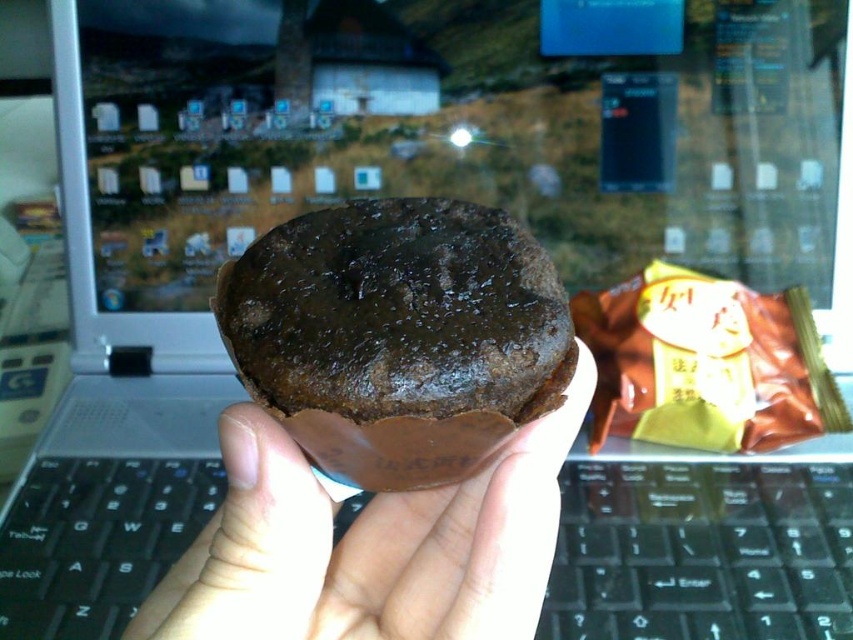
You are trying to determine the distance between two points in the image. The first point is located at coordinates point (756, 611) and the second point is at point (445, 237). Which point is closer to you?

Point (756, 611) is closer to you because it is further to the viewer than point (445, 237).

You are a delivery robot that needs to place a small package between the black plastic keyboard at center and the brown matte cupcake at center. The package is 12 inches long. Will it fit in the space between them?

The black plastic keyboard at center and brown matte cupcake at center are 13.25 inches apart, so the 12 inch package will fit between them as there is enough space.

You are organizing a desk and need to place both the black plastic keyboard at center and the brown matte cupcake at center. Which object requires more desk space?

The black plastic keyboard at center is larger in size than the brown matte cupcake at center, so it requires more desk space.